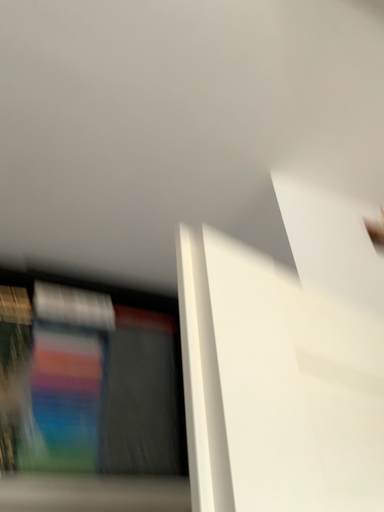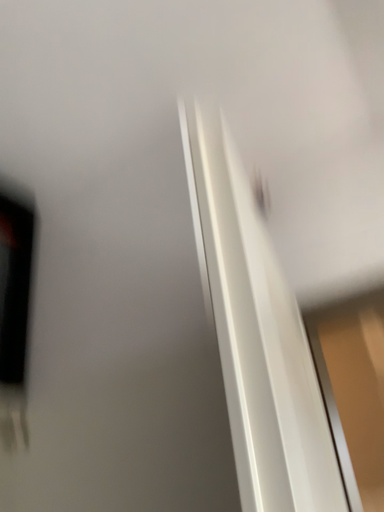
Question: Which way did the camera rotate in the video?

Choices:
 (A) rotated right
 (B) rotated left

Answer: (A)